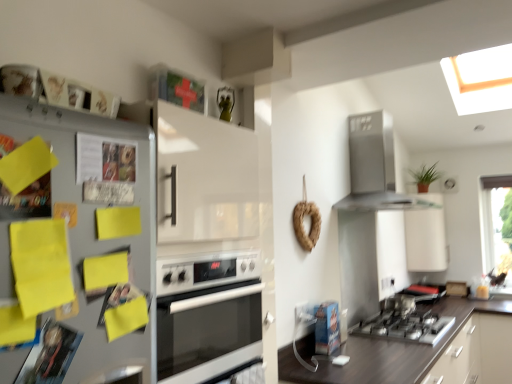
Question: Is transparent glass window at upper right surrounding satin silver range hood at upper right?

Choices:
 (A) yes
 (B) no

Answer: (B)

Question: Is transparent glass window at upper right looking in the opposite direction of satin silver range hood at upper right?

Choices:
 (A) no
 (B) yes

Answer: (A)

Question: Is the position of transparent glass window at upper right less distant than that of satin silver range hood at upper right?

Choices:
 (A) no
 (B) yes

Answer: (A)

Question: Can you confirm if transparent glass window at upper right is bigger than satin silver range hood at upper right?

Choices:
 (A) no
 (B) yes

Answer: (A)

Question: Is transparent glass window at upper right at the right side of satin silver range hood at upper right?

Choices:
 (A) no
 (B) yes

Answer: (B)

Question: Is dark brown wood at lower right inside the boundaries of green leafy plant at upper right, or outside?

Choices:
 (A) outside
 (B) inside

Answer: (A)

Question: From a real-world perspective, is dark brown wood at lower right physically located above or below green leafy plant at upper right?

Choices:
 (A) above
 (B) below

Answer: (B)

Question: In terms of width, does dark brown wood at lower right look wider or thinner when compared to green leafy plant at upper right?

Choices:
 (A) thin
 (B) wide

Answer: (B)

Question: In terms of size, does dark brown wood at lower right appear bigger or smaller than green leafy plant at upper right?

Choices:
 (A) big
 (B) small

Answer: (A)

Question: Is white glossy oven at center inside or outside of dark brown wood at lower right?

Choices:
 (A) inside
 (B) outside

Answer: (B)

Question: From the image's perspective, is white glossy oven at center above or below dark brown wood at lower right?

Choices:
 (A) above
 (B) below

Answer: (A)

Question: From a real-world perspective, is white glossy oven at center positioned above or below dark brown wood at lower right?

Choices:
 (A) below
 (B) above

Answer: (B)

Question: Is white glossy oven at center bigger or smaller than dark brown wood at lower right?

Choices:
 (A) big
 (B) small

Answer: (B)

Question: Looking at their shapes, would you say green leafy plant at upper right is wider or thinner than metallic gray refrigerator at left?

Choices:
 (A) wide
 (B) thin

Answer: (A)

Question: Is green leafy plant at upper right taller or shorter than metallic gray refrigerator at left?

Choices:
 (A) short
 (B) tall

Answer: (A)